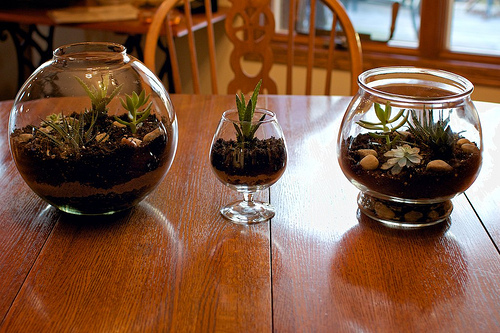
You are a GUI agent. You are given a task and a screenshot of the screen. Output one action in this format:
    pyautogui.click(x=<x>, y=<y>)
    Task: Click on the woodgrain
    
    Given the screenshot: What is the action you would take?
    pyautogui.click(x=131, y=260), pyautogui.click(x=367, y=265)